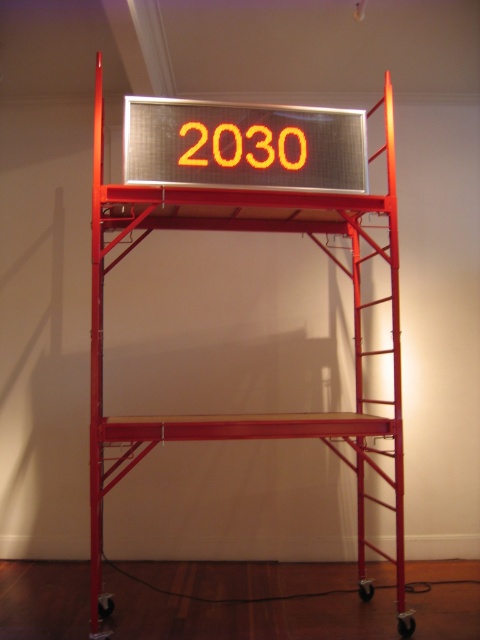
You are an event organizer setting up for a futuristic exhibition. You have two orange LED elements to place on the scaffolding structure. The orange led sign at center and the orange led digits at center. Based on their sizes, which one should you position higher to ensure visibility from a distance?

The orange led sign at center is bigger than orange led digits at center, so positioning the orange led sign at center higher would ensure better visibility from a distance due to its larger size.

You are an event organizer setting up for a tech conference. You need to adjust the height of the orange led digits at center. To do this, you must first climb the metallic red ladder at center. Is the ladder accessible from your current position in front of the scaffolding?

Yes, the metallic red ladder at center is accessible because it is closer to the viewer than the orange led digits at center, meaning you can reach it without obstruction to climb and adjust the display.

You are an event organizer setting up a digital display for a futuristic event. You need to ensure there is enough space between the orange led sign at center and the orange led digits at center so that both are clearly visible to the audience. Given that the minimum recommended spacing between such elements is 5 centimeters, will the current setup meet this requirement?

The orange led sign at center is 4.77 centimeters from orange led digits at center, which is less than the recommended 5 centimeters. Therefore, the current setup does not meet the spacing requirement, and adjustments are needed to ensure clarity for the audience.